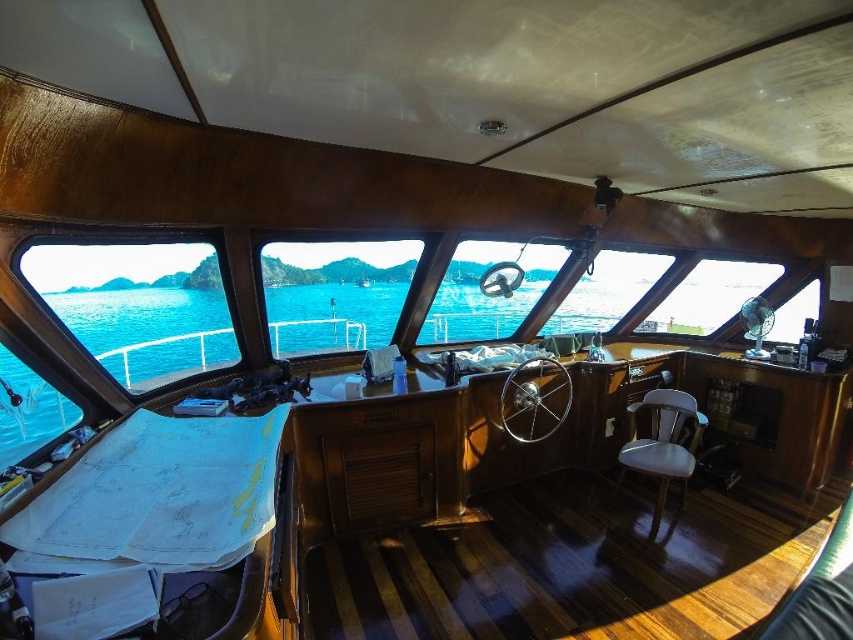
You are sitting in the white leather chair at lower right and want to look out through the transparent glass window at center. Can you see the window directly in front of you?

The transparent glass window at center is in front of the white leather chair at lower right, so yes, you can see the window directly in front of you.

Looking at this image, you are a passenger on the boat and want to enjoy the view outside. The transparent glass window at center and the white leather chair at lower right are both in your path. Which object is wider so you can choose the best spot to sit?

The transparent glass window at center is wider than the white leather chair at lower right, so you can choose the transparent glass window at center for a better view.

You are standing in the cockpit of the boat and want to reach both the point at coordinates point [106,330] and the point at coordinates point [654,472]. Which point will you reach first if you move forward from your current position?

You will reach the point at coordinates point [106,330] first because it is closer to you than the point at coordinates point [654,472].